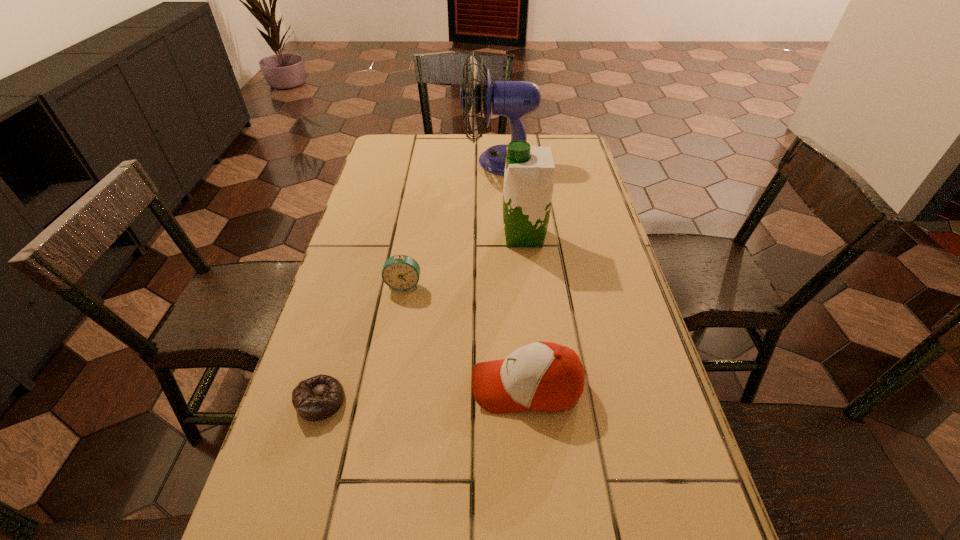
Find the location of `object at the far edge`. object at the far edge is located at coordinates (514, 99).

Locate an element on the screen. The height and width of the screenshot is (540, 960). alarm clock situated at the left edge is located at coordinates (400, 272).

The width and height of the screenshot is (960, 540). Find the location of `beanbag located in the left edge section of the desktop`. beanbag located in the left edge section of the desktop is located at coordinates pos(317,398).

The height and width of the screenshot is (540, 960). What are the coordinates of `vacant area at the far edge` in the screenshot? It's located at (444, 143).

The image size is (960, 540). Find the location of `free space at the left edge of the desktop`. free space at the left edge of the desktop is located at coordinates (317, 340).

Where is `vacant space at the right edge`? vacant space at the right edge is located at coordinates (628, 304).

Locate an element on the screen. This screenshot has width=960, height=540. vacant space that is in between the baseball cap and the soya milk is located at coordinates (525, 312).

The width and height of the screenshot is (960, 540). I want to click on vacant area that lies between the soya milk and the beanbag, so point(422,318).

You are a GUI agent. You are given a task and a screenshot of the screen. Output one action in this format:
    pyautogui.click(x=<x>, y=<y>)
    Task: Click on the vacant space that's between the baseball cap and the tallest object
    
    Given the screenshot: What is the action you would take?
    pyautogui.click(x=514, y=274)

This screenshot has height=540, width=960. I want to click on vacant point located between the baseball cap and the fourth object from right to left, so click(466, 336).